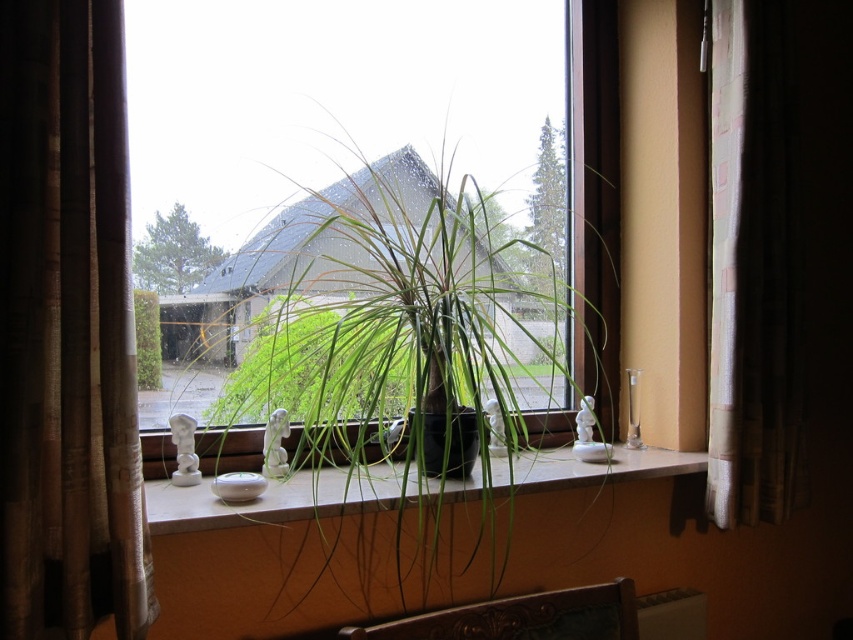
You are standing in front of the window and want to adjust the curtains. Which curtain, the brown textured curtain at left or the brown textured curtain at right, is easier to reach without moving your position?

The brown textured curtain at left is closer to the viewer, so it is easier to reach without moving your position.

From the picture: You are standing in the room looking at the window. Can you see the green matte plant at center through the brown textured curtain at right?

The brown textured curtain at right is positioned over the green matte plant at center, so the plant is partially or fully obscured by the curtain.